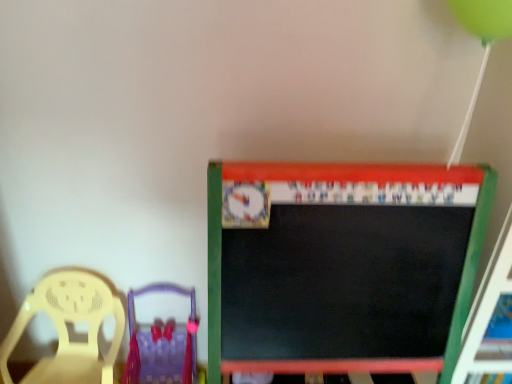
The image size is (512, 384). Describe the element at coordinates (67, 330) in the screenshot. I see `matte yellow chair at left, arranged as the 2th chair when viewed from the right` at that location.

The width and height of the screenshot is (512, 384). Find the location of `matte yellow chair at left, arranged as the 2th chair when viewed from the right`. matte yellow chair at left, arranged as the 2th chair when viewed from the right is located at coordinates point(67,330).

What do you see at coordinates (161, 344) in the screenshot?
I see `purple fabric chair at lower left, the first chair positioned from the right` at bounding box center [161, 344].

You are a GUI agent. You are given a task and a screenshot of the screen. Output one action in this format:
    pyautogui.click(x=<x>, y=<y>)
    Task: Click on the purple fabric chair at lower left, the first chair positioned from the right
    
    Given the screenshot: What is the action you would take?
    pyautogui.click(x=161, y=344)

Find the location of `matte yellow chair at left, arranged as the 2th chair when viewed from the right`. matte yellow chair at left, arranged as the 2th chair when viewed from the right is located at coordinates (67, 330).

Considering the positions of objects purple fabric chair at lower left, the 2th chair when ordered from left to right, and matte yellow chair at left, which is the 1th chair in left-to-right order, in the image provided, who is more to the right, purple fabric chair at lower left, the 2th chair when ordered from left to right, or matte yellow chair at left, which is the 1th chair in left-to-right order,?

purple fabric chair at lower left, the 2th chair when ordered from left to right, is more to the right.

From the picture: Is purple fabric chair at lower left, the 2th chair when ordered from left to right, further to the viewer compared to matte yellow chair at left, which is the 1th chair in left-to-right order?

That is True.

Is point (194, 292) less distant than point (67, 357)?

No, (194, 292) is behind (67, 357).

From the image's perspective, which is below, purple fabric chair at lower left, the 2th chair when ordered from left to right, or matte yellow chair at left, which is the 1th chair in left-to-right order?

purple fabric chair at lower left, the 2th chair when ordered from left to right, appears lower in the image.

From a real-world perspective, who is located higher, purple fabric chair at lower left, the first chair positioned from the right, or matte yellow chair at left, which is the 1th chair in left-to-right order?

In real-world perspective, matte yellow chair at left, which is the 1th chair in left-to-right order, is above.

Considering the sizes of objects purple fabric chair at lower left, the 2th chair when ordered from left to right, and matte yellow chair at left, arranged as the 2th chair when viewed from the right, in the image provided, who is thinner, purple fabric chair at lower left, the 2th chair when ordered from left to right, or matte yellow chair at left, arranged as the 2th chair when viewed from the right,?

matte yellow chair at left, arranged as the 2th chair when viewed from the right, is thinner.

Is purple fabric chair at lower left, the first chair positioned from the right, taller than matte yellow chair at left, which is the 1th chair in left-to-right order?

No, purple fabric chair at lower left, the first chair positioned from the right, is not taller than matte yellow chair at left, which is the 1th chair in left-to-right order.

Who is smaller, purple fabric chair at lower left, the first chair positioned from the right, or matte yellow chair at left, which is the 1th chair in left-to-right order?

With smaller size is purple fabric chair at lower left, the first chair positioned from the right.

Is matte yellow chair at left, arranged as the 2th chair when viewed from the right, inside purple fabric chair at lower left, the 2th chair when ordered from left to right?

Definitely not — matte yellow chair at left, arranged as the 2th chair when viewed from the right, is not inside purple fabric chair at lower left, the 2th chair when ordered from left to right.

Are purple fabric chair at lower left, the first chair positioned from the right, and matte yellow chair at left, which is the 1th chair in left-to-right order, located far from each other?

purple fabric chair at lower left, the first chair positioned from the right, is actually quite close to matte yellow chair at left, which is the 1th chair in left-to-right order.

Could you tell me if purple fabric chair at lower left, the 2th chair when ordered from left to right, is turned towards matte yellow chair at left, which is the 1th chair in left-to-right order?

No.

I want to click on chair behind the matte yellow chair at left, arranged as the 2th chair when viewed from the right, so click(161, 344).

Is matte yellow chair at left, arranged as the 2th chair when viewed from the right, to the right of purple fabric chair at lower left, the 2th chair when ordered from left to right, from the viewer's perspective?

No, matte yellow chair at left, arranged as the 2th chair when viewed from the right, is not to the right of purple fabric chair at lower left, the 2th chair when ordered from left to right.

Considering the positions of objects matte yellow chair at left, which is the 1th chair in left-to-right order, and purple fabric chair at lower left, the 2th chair when ordered from left to right, in the image provided, who is in front, matte yellow chair at left, which is the 1th chair in left-to-right order, or purple fabric chair at lower left, the 2th chair when ordered from left to right,?

matte yellow chair at left, which is the 1th chair in left-to-right order, is closer to the camera.

Is point (91, 377) positioned before point (176, 334)?

Yes, point (91, 377) is in front of point (176, 334).

From the image's perspective, which is below, matte yellow chair at left, arranged as the 2th chair when viewed from the right, or purple fabric chair at lower left, the first chair positioned from the right?

purple fabric chair at lower left, the first chair positioned from the right, from the image's perspective.

From a real-world perspective, is matte yellow chair at left, arranged as the 2th chair when viewed from the right, physically located above or below purple fabric chair at lower left, the 2th chair when ordered from left to right?

matte yellow chair at left, arranged as the 2th chair when viewed from the right, is above purple fabric chair at lower left, the 2th chair when ordered from left to right.

Which object is wider, matte yellow chair at left, arranged as the 2th chair when viewed from the right, or purple fabric chair at lower left, the 2th chair when ordered from left to right?

purple fabric chair at lower left, the 2th chair when ordered from left to right, is wider.

Which of these two, matte yellow chair at left, which is the 1th chair in left-to-right order, or purple fabric chair at lower left, the 2th chair when ordered from left to right, stands taller?

Standing taller between the two is matte yellow chair at left, which is the 1th chair in left-to-right order.

Who is smaller, matte yellow chair at left, which is the 1th chair in left-to-right order, or purple fabric chair at lower left, the 2th chair when ordered from left to right?

Result: purple fabric chair at lower left, the 2th chair when ordered from left to right, is smaller.

Would you say matte yellow chair at left, arranged as the 2th chair when viewed from the right, is inside or outside purple fabric chair at lower left, the 2th chair when ordered from left to right?

matte yellow chair at left, arranged as the 2th chair when viewed from the right, cannot be found inside purple fabric chair at lower left, the 2th chair when ordered from left to right.

Would you consider matte yellow chair at left, arranged as the 2th chair when viewed from the right, to be distant from purple fabric chair at lower left, the first chair positioned from the right?

matte yellow chair at left, arranged as the 2th chair when viewed from the right, is actually quite close to purple fabric chair at lower left, the first chair positioned from the right.

Based on the photo, is matte yellow chair at left, which is the 1th chair in left-to-right order, positioned with its back to purple fabric chair at lower left, the first chair positioned from the right?

No.

How far apart are matte yellow chair at left, arranged as the 2th chair when viewed from the right, and purple fabric chair at lower left, the first chair positioned from the right?

matte yellow chair at left, arranged as the 2th chair when viewed from the right, is 7.24 inches from purple fabric chair at lower left, the first chair positioned from the right.

You are a GUI agent. You are given a task and a screenshot of the screen. Output one action in this format:
    pyautogui.click(x=<x>, y=<y>)
    Task: Click on the chair to the left of purple fabric chair at lower left, the 2th chair when ordered from left to right
    
    Given the screenshot: What is the action you would take?
    pyautogui.click(x=67, y=330)

Where is `chair beneath the matte yellow chair at left, arranged as the 2th chair when viewed from the right (from a real-world perspective)`? The image size is (512, 384). chair beneath the matte yellow chair at left, arranged as the 2th chair when viewed from the right (from a real-world perspective) is located at coordinates (161, 344).

The height and width of the screenshot is (384, 512). In the image, there is a matte yellow chair at left, which is the 1th chair in left-to-right order. Find the location of `chair below it (from the image's perspective)`. chair below it (from the image's perspective) is located at coordinates (161, 344).